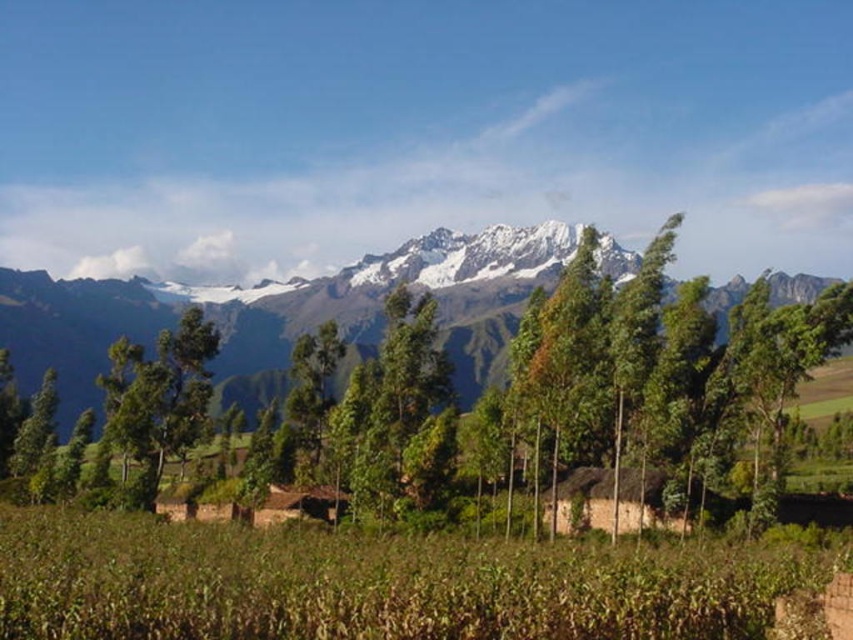
Is point (88, 321) positioned before point (125, 483)?

No.

In the scene shown: Between snowy rock mountain range at upper center and green leafy tree at center, which one has more height?

Standing taller between the two is snowy rock mountain range at upper center.

Does point (500, 289) come in front of point (163, 456)?

No, (500, 289) is behind (163, 456).

Where is `snowy rock mountain range at upper center`? Image resolution: width=853 pixels, height=640 pixels. snowy rock mountain range at upper center is located at coordinates (287, 308).

Between green grassy field at lower center and snowy rock mountain range at upper center, which one is positioned higher?

Positioned higher is snowy rock mountain range at upper center.

How distant is green grassy field at lower center from snowy rock mountain range at upper center?

green grassy field at lower center and snowy rock mountain range at upper center are 164.59 meters apart.

The height and width of the screenshot is (640, 853). What do you see at coordinates (373, 584) in the screenshot?
I see `green grassy field at lower center` at bounding box center [373, 584].

At what (x,y) coordinates should I click in order to perform the action: click on green grassy field at lower center. Please return your answer as a coordinate pair (x, y). Looking at the image, I should click on (373, 584).

Can you confirm if green grassy field at lower center is bigger than green leafy tree at center?

No.

Is point (41, 512) farther from viewer compared to point (140, 413)?

No, (41, 512) is in front of (140, 413).

Which is in front, point (311, 636) or point (126, 346)?

Point (311, 636) is more forward.

At what (x,y) coordinates should I click in order to perform the action: click on green grassy field at lower center. Please return your answer as a coordinate pair (x, y). This screenshot has width=853, height=640. Looking at the image, I should click on (373, 584).